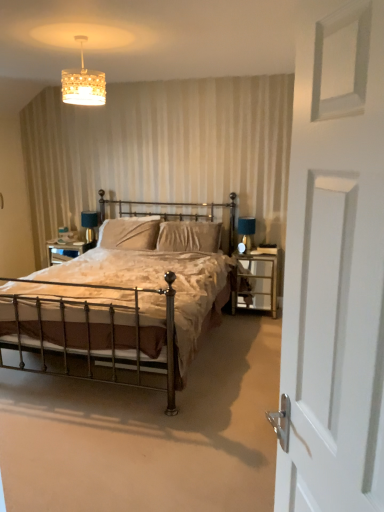
Where is `white matte door at right`? This screenshot has width=384, height=512. white matte door at right is located at coordinates (334, 348).

What do you see at coordinates (246, 231) in the screenshot? The height and width of the screenshot is (512, 384). I see `matte blue glass table lamp at right` at bounding box center [246, 231].

Describe the element at coordinates (257, 281) in the screenshot. I see `metal/glass nightstand at right` at that location.

Locate an element on the screen. This screenshot has height=512, width=384. velvet beige pillow at center, arranged as the first pillow when viewed from the left is located at coordinates (129, 233).

I want to click on bronze metal bed at center, so click(x=118, y=312).

This screenshot has height=512, width=384. What do you see at coordinates (83, 83) in the screenshot?
I see `crystalline glass chandelier at upper center` at bounding box center [83, 83].

Locate an element on the screen. This screenshot has width=384, height=512. velvet beige pillow at center, positioned as the 2th pillow in left-to-right order is located at coordinates (189, 236).

Between point (253, 292) and point (239, 220), which one is positioned behind?

The point (239, 220) is farther.

Do you think metal/glass nightstand at right is within matte blue glass table lamp at right, or outside of it?

metal/glass nightstand at right is spatially situated outside matte blue glass table lamp at right.

Is metal/glass nightstand at right wider than matte blue glass table lamp at right?

→ Yes.

Which of these two, metal/glass nightstand at right or matte blue glass table lamp at right, stands taller?

metal/glass nightstand at right.

Is bronze metal bed at center looking in the opposite direction of velvet beige pillow at center, placed as the 1th pillow when sorted from right to left?

Yes, bronze metal bed at center is positioned with its back facing velvet beige pillow at center, placed as the 1th pillow when sorted from right to left.

Is bronze metal bed at center next to velvet beige pillow at center, placed as the 1th pillow when sorted from right to left, and touching it?

No.

Where is `pillow that is the 1st object located behind the bronze metal bed at center`? pillow that is the 1st object located behind the bronze metal bed at center is located at coordinates (189, 236).

Does bronze metal bed at center appear on the left side of velvet beige pillow at center, placed as the 1th pillow when sorted from right to left?

Correct, you'll find bronze metal bed at center to the left of velvet beige pillow at center, placed as the 1th pillow when sorted from right to left.

Considering the relative sizes of velvet beige pillow at center, positioned as the 2th pillow in left-to-right order, and metal/glass nightstand at right in the image provided, is velvet beige pillow at center, positioned as the 2th pillow in left-to-right order, shorter than metal/glass nightstand at right?

Yes.

Is velvet beige pillow at center, positioned as the 2th pillow in left-to-right order, touching metal/glass nightstand at right?

velvet beige pillow at center, positioned as the 2th pillow in left-to-right order, and metal/glass nightstand at right are clearly separated.

Consider the image. Which object is wider, velvet beige pillow at center, positioned as the 2th pillow in left-to-right order, or metal/glass nightstand at right?

metal/glass nightstand at right.

From the picture: From the image's perspective, is velvet beige pillow at center, positioned as the 2th pillow in left-to-right order, located beneath metal/glass nightstand at right?

No, from the image's perspective, velvet beige pillow at center, positioned as the 2th pillow in left-to-right order, is not beneath metal/glass nightstand at right.

Considering the sizes of velvet beige pillow at center, arranged as the first pillow when viewed from the left, and velvet beige pillow at center, placed as the 1th pillow when sorted from right to left, in the image, is velvet beige pillow at center, arranged as the first pillow when viewed from the left, bigger or smaller than velvet beige pillow at center, placed as the 1th pillow when sorted from right to left,?

In the image, velvet beige pillow at center, arranged as the first pillow when viewed from the left, appears to be smaller than velvet beige pillow at center, placed as the 1th pillow when sorted from right to left.

In the scene shown: Would you say velvet beige pillow at center, the second pillow when ordered from right to left, is a long distance from velvet beige pillow at center, placed as the 1th pillow when sorted from right to left?

They are positioned close to each other.

In the scene shown: Is velvet beige pillow at center, the second pillow when ordered from right to left, facing towards velvet beige pillow at center, positioned as the 2th pillow in left-to-right order?

No.

Where is `pillow in front of the velvet beige pillow at center, arranged as the first pillow when viewed from the left`? pillow in front of the velvet beige pillow at center, arranged as the first pillow when viewed from the left is located at coordinates pos(189,236).

Is crystalline glass chandelier at upper center with white matte door at right?

They are not placed beside each other.

Between crystalline glass chandelier at upper center and white matte door at right, which one has larger width?

crystalline glass chandelier at upper center is wider.

Does crystalline glass chandelier at upper center lie in front of white matte door at right?

No, it is behind white matte door at right.

Locate an element on the screen. The height and width of the screenshot is (512, 384). pillow that is the 2nd object located above the metal/glass nightstand at right (from the image's perspective) is located at coordinates (129, 233).

Does velvet beige pillow at center, the second pillow when ordered from right to left, have a smaller size compared to metal/glass nightstand at right?

Indeed, velvet beige pillow at center, the second pillow when ordered from right to left, has a smaller size compared to metal/glass nightstand at right.

Considering the sizes of velvet beige pillow at center, the second pillow when ordered from right to left, and metal/glass nightstand at right in the image, is velvet beige pillow at center, the second pillow when ordered from right to left, wider or thinner than metal/glass nightstand at right?

velvet beige pillow at center, the second pillow when ordered from right to left, is thinner than metal/glass nightstand at right.

Based on the photo, between velvet beige pillow at center, arranged as the first pillow when viewed from the left, and metal/glass nightstand at right, which one has less height?

velvet beige pillow at center, arranged as the first pillow when viewed from the left.

Considering the sizes of objects bronze metal bed at center and metal/glass nightstand at right in the image provided, who is bigger, bronze metal bed at center or metal/glass nightstand at right?

bronze metal bed at center is bigger.

Would you say bronze metal bed at center contains metal/glass nightstand at right?

No.

Is bronze metal bed at center taller than metal/glass nightstand at right?

Yes, bronze metal bed at center is taller than metal/glass nightstand at right.

From the image's perspective, is bronze metal bed at center positioned above or below metal/glass nightstand at right?

Based on their image positions, bronze metal bed at center is located above metal/glass nightstand at right.

You are a GUI agent. You are given a task and a screenshot of the screen. Output one action in this format:
    pyautogui.click(x=<x>, y=<y>)
    Task: Click on the table lamp that is above the metal/glass nightstand at right (from a real-world perspective)
    This screenshot has height=512, width=384.
    Given the screenshot: What is the action you would take?
    pyautogui.click(x=246, y=231)

The image size is (384, 512). I want to click on pillow that is on the right side of bronze metal bed at center, so click(189, 236).

Considering their positions, is matte blue glass table lamp at right positioned closer to crystalline glass chandelier at upper center than velvet beige pillow at center, placed as the 1th pillow when sorted from right to left?

The object closer to crystalline glass chandelier at upper center is velvet beige pillow at center, placed as the 1th pillow when sorted from right to left.

Based on their spatial positions, is crystalline glass chandelier at upper center or velvet beige pillow at center, positioned as the 2th pillow in left-to-right order, further from bronze metal bed at center?

crystalline glass chandelier at upper center is further to bronze metal bed at center.

Estimate the real-world distances between objects in this image. Which object is closer to bronze metal bed at center, white matte door at right or velvet beige pillow at center, arranged as the first pillow when viewed from the left?

velvet beige pillow at center, arranged as the first pillow when viewed from the left, lies closer to bronze metal bed at center than the other object.

Estimate the real-world distances between objects in this image. Which object is closer to velvet beige pillow at center, placed as the 1th pillow when sorted from right to left, crystalline glass chandelier at upper center or matte blue glass table lamp at right?

matte blue glass table lamp at right is positioned closer to the anchor velvet beige pillow at center, placed as the 1th pillow when sorted from right to left.

Estimate the real-world distances between objects in this image. Which object is closer to crystalline glass chandelier at upper center, metal/glass nightstand at right or matte blue glass table lamp at right?

The object closer to crystalline glass chandelier at upper center is matte blue glass table lamp at right.

Looking at the image, which one is located closer to matte blue glass table lamp at right, velvet beige pillow at center, placed as the 1th pillow when sorted from right to left, or crystalline glass chandelier at upper center?

velvet beige pillow at center, placed as the 1th pillow when sorted from right to left, lies closer to matte blue glass table lamp at right than the other object.

From the image, which object appears to be nearer to metal/glass nightstand at right, bronze metal bed at center or crystalline glass chandelier at upper center?

Based on the image, bronze metal bed at center appears to be nearer to metal/glass nightstand at right.

Based on their spatial positions, is bronze metal bed at center or white matte door at right further from matte blue glass table lamp at right?

The object further to matte blue glass table lamp at right is white matte door at right.

This screenshot has height=512, width=384. I want to click on nightstand positioned between crystalline glass chandelier at upper center and velvet beige pillow at center, positioned as the 2th pillow in left-to-right order, from near to far, so click(x=257, y=281).

Where is `lighting between bronze metal bed at center and velvet beige pillow at center, the second pillow when ordered from right to left, in the front-back direction`? lighting between bronze metal bed at center and velvet beige pillow at center, the second pillow when ordered from right to left, in the front-back direction is located at coordinates (83, 83).

You are a GUI agent. You are given a task and a screenshot of the screen. Output one action in this format:
    pyautogui.click(x=<x>, y=<y>)
    Task: Click on the pillow between white matte door at right and velvet beige pillow at center, arranged as the first pillow when viewed from the left, along the z-axis
    
    Given the screenshot: What is the action you would take?
    pyautogui.click(x=189, y=236)

This screenshot has width=384, height=512. Identify the location of nightstand between bronze metal bed at center and velvet beige pillow at center, the second pillow when ordered from right to left, from front to back. (257, 281).